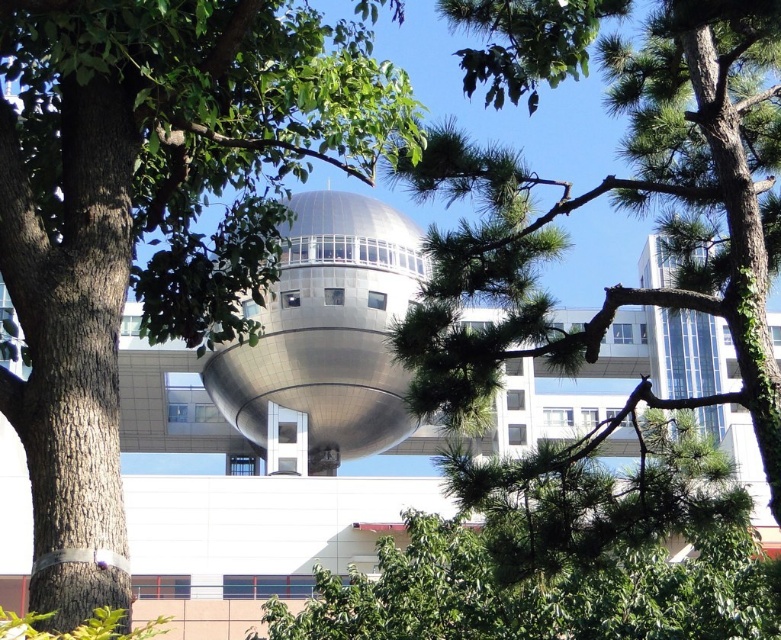
Question: Which object appears closest to the camera in this image?

Choices:
 (A) green leafy tree at center
 (B) green needle-like leaves at center

Answer: (A)

Question: Does green leafy tree at center appear on the left side of green needle-like leaves at center?

Choices:
 (A) yes
 (B) no

Answer: (A)

Question: Which point is farther from the camera taking this photo?

Choices:
 (A) (557, 353)
 (B) (63, 93)

Answer: (A)

Question: Considering the relative positions of green leafy tree at center and green needle-like leaves at center in the image provided, where is green leafy tree at center located with respect to green needle-like leaves at center?

Choices:
 (A) right
 (B) left

Answer: (B)

Question: Among these points, which one is nearest to the camera?

Choices:
 (A) (66, 376)
 (B) (396, 172)

Answer: (A)

Question: Is green leafy tree at center thinner than green needle-like leaves at center?

Choices:
 (A) yes
 (B) no

Answer: (B)